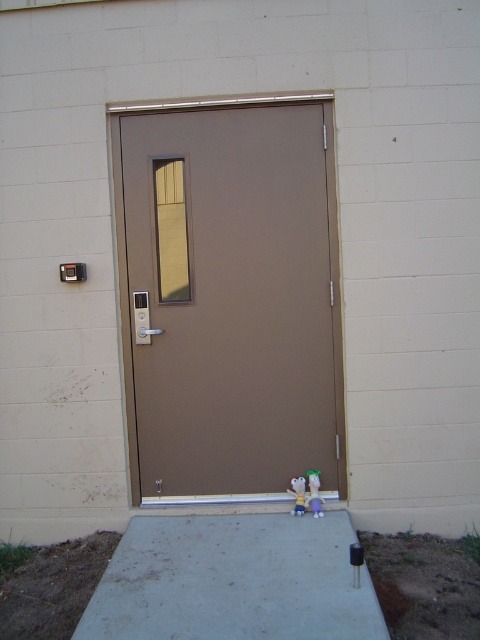
Between matte brown door at center and plush green at lower center, which one is positioned higher?

matte brown door at center is above.

Between matte brown door at center and plush green at lower center, which one has less height?

plush green at lower center is shorter.

Is point (298, 326) positioned before point (300, 492)?

No, (298, 326) is behind (300, 492).

Image resolution: width=480 pixels, height=640 pixels. What are the coordinates of `matte brown door at center` in the screenshot? It's located at (230, 300).

Is matte brown door at center positioned before purple fabric toy at lower center?

That is False.

Does matte brown door at center have a smaller size compared to purple fabric toy at lower center?

No.

In the scene shown: Who is more distant from viewer, (171,424) or (312,480)?

The point (171,424) is more distant.

You are a GUI agent. You are given a task and a screenshot of the screen. Output one action in this format:
    pyautogui.click(x=<x>, y=<y>)
    Task: Click on the matte brown door at center
    The width and height of the screenshot is (480, 640).
    Given the screenshot: What is the action you would take?
    pyautogui.click(x=230, y=300)

Which of these two, purple fabric toy at lower center or plush green at lower center, stands shorter?

plush green at lower center

In the scene shown: Who is positioned more to the left, purple fabric toy at lower center or plush green at lower center?

Positioned to the left is plush green at lower center.

Who is more distant from viewer, (317, 480) or (300, 499)?

Result: The point (317, 480) is behind.

Locate an element on the screen. This screenshot has height=640, width=480. purple fabric toy at lower center is located at coordinates (314, 493).